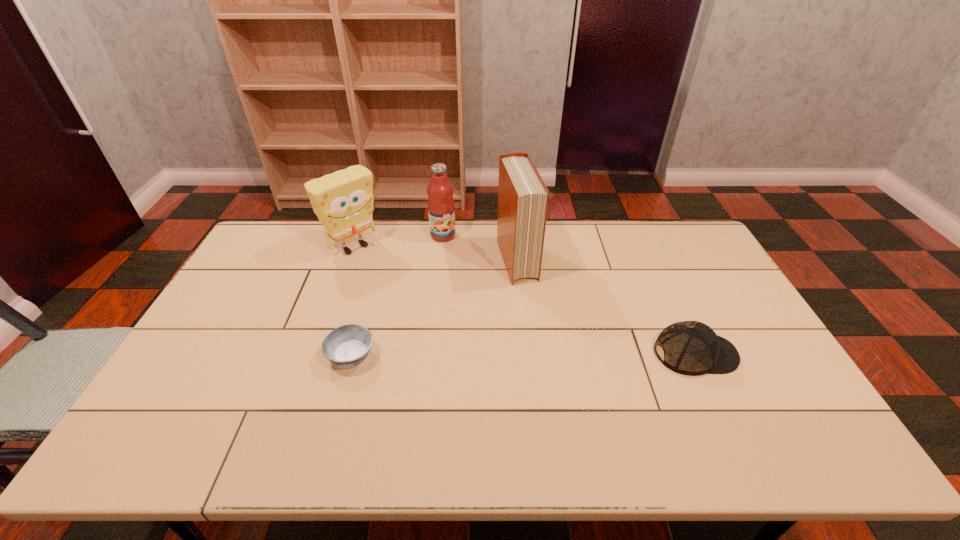
In order to click on sponge that is at the far edge in this screenshot , I will do `click(343, 201)`.

Locate an element on the screen. The height and width of the screenshot is (540, 960). object present at the right edge is located at coordinates (692, 348).

You are a GUI agent. You are given a task and a screenshot of the screen. Output one action in this format:
    pyautogui.click(x=<x>, y=<y>)
    Task: Click on the vacant space at the far edge of the desktop
    The width and height of the screenshot is (960, 540).
    Given the screenshot: What is the action you would take?
    pyautogui.click(x=594, y=231)

This screenshot has width=960, height=540. In the image, there is a desktop. Find the location of `vacant space at the near edge`. vacant space at the near edge is located at coordinates (665, 397).

What are the coordinates of `free space at the left edge of the desktop` in the screenshot? It's located at (244, 303).

The height and width of the screenshot is (540, 960). Find the location of `free space at the right edge of the desktop`. free space at the right edge of the desktop is located at coordinates (777, 387).

At what (x,y) coordinates should I click in order to perform the action: click on free space at the far left corner of the desktop. Please return your answer as a coordinate pair (x, y). The width and height of the screenshot is (960, 540). Looking at the image, I should click on (305, 238).

Where is `blank space at the near left corner of the desktop`? This screenshot has width=960, height=540. blank space at the near left corner of the desktop is located at coordinates (209, 391).

Identify the location of blank space at the far right corner of the desktop. The width and height of the screenshot is (960, 540). (690, 225).

Locate an element on the screen. This screenshot has height=540, width=960. free space between the second object from right to left and the third object from right to left is located at coordinates (480, 248).